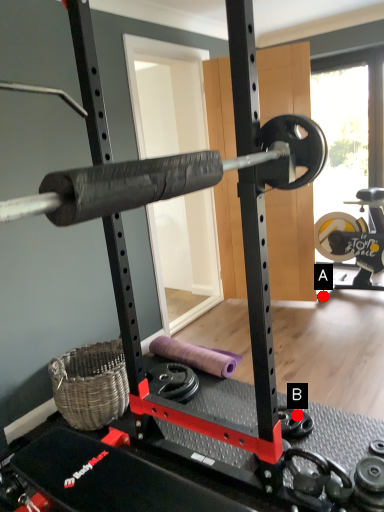
Question: Two points are circled on the image, labeled by A and B beside each circle. Which point is closer to the camera?

Choices:
 (A) A is closer
 (B) B is closer

Answer: (B)